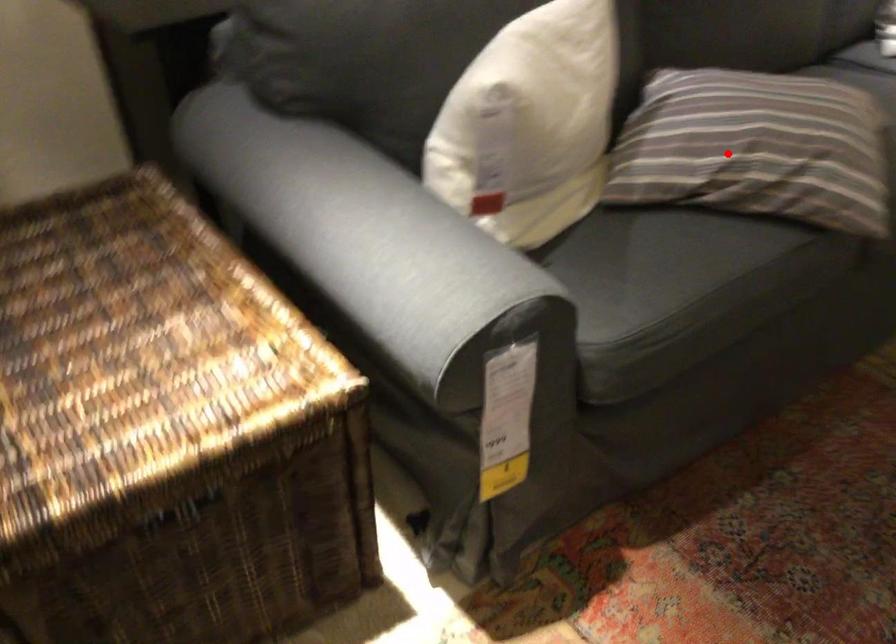
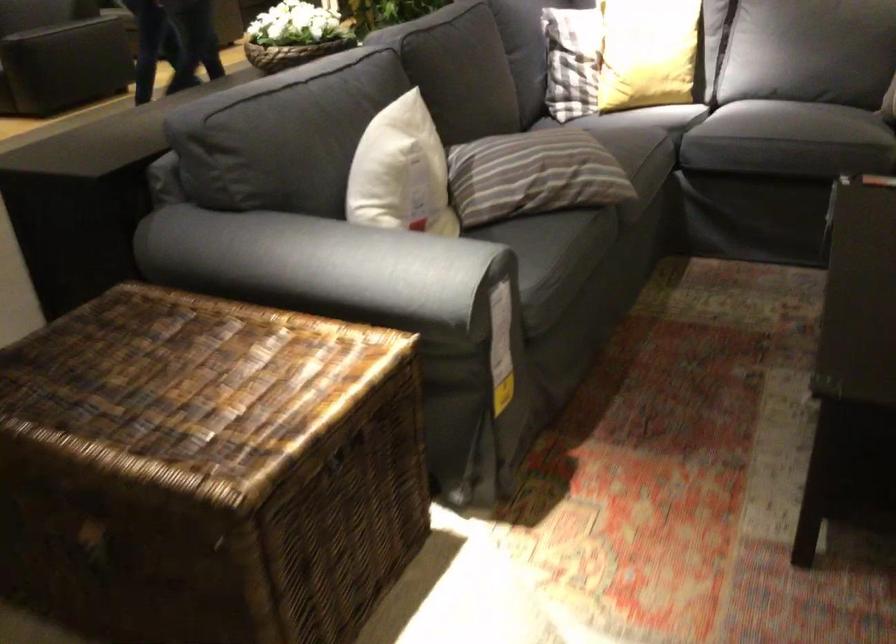
Question: I am providing you with two images of the same scene from different viewpoints. Image1 has a red point marked. In image2, the corresponding 3D location appears at what relative position? Reply with the corresponding letter.

Choices:
 (A) Closer
 (B) Farther

Answer: (B)